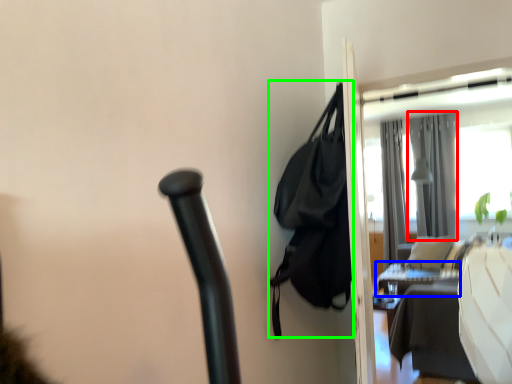
Question: Considering the real-world distances, which object is closest to curtain (highlighted by a red box)? table (highlighted by a blue box) or bag (highlighted by a green box).

Choices:
 (A) table
 (B) bag

Answer: (A)